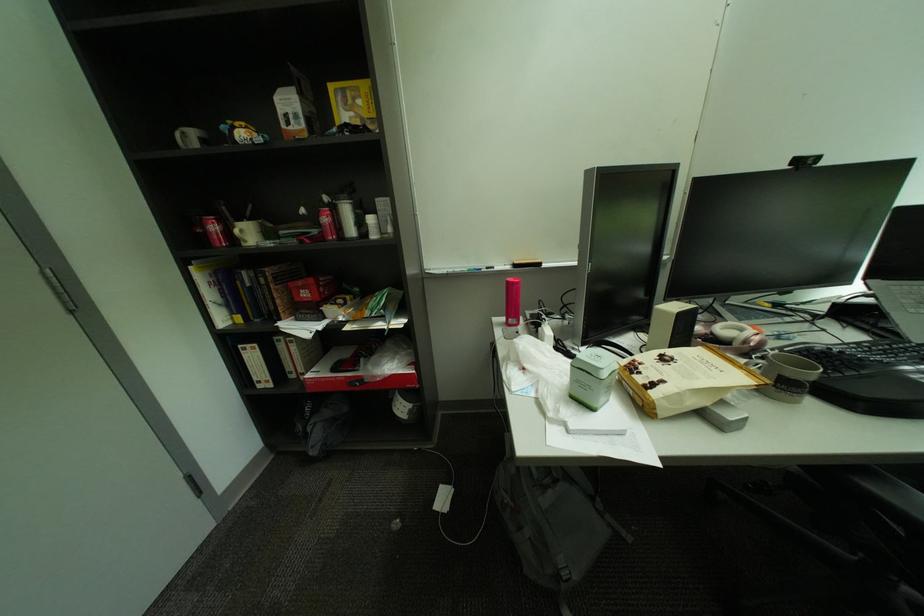
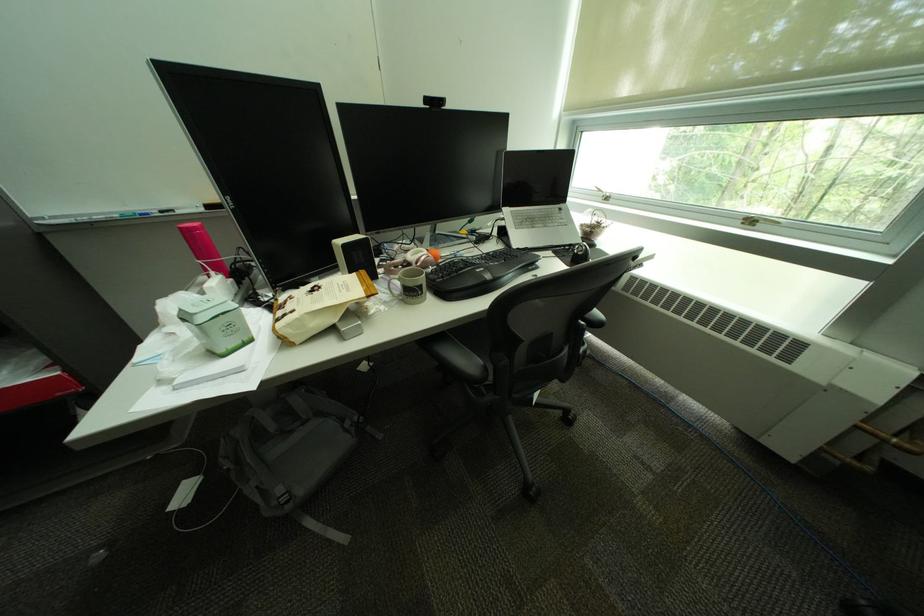
The point at (x=518, y=284) is marked in the first image. Where is the corresponding point in the second image?

(190, 230)